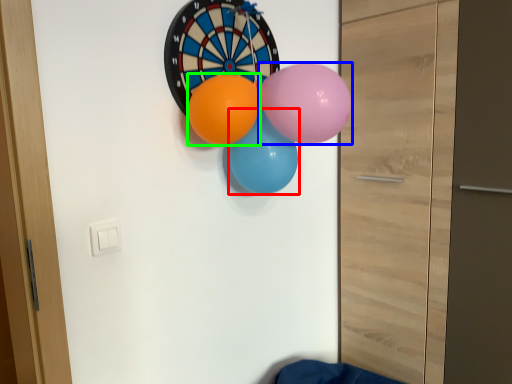
Question: Based on their relative distances, which object is farther from balloon (highlighted by a red box)? Choose from balloon (highlighted by a blue box) and balloon (highlighted by a green box).

Choices:
 (A) balloon
 (B) balloon

Answer: (A)